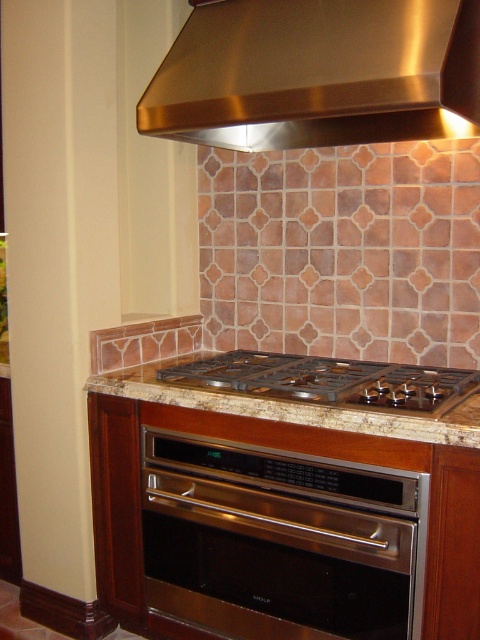
Question: In this image, where is stainless steel oven at center located relative to marble/granite countertop at center?

Choices:
 (A) left
 (B) right

Answer: (A)

Question: Which object is positioned closest to the marble/granite countertop at center?

Choices:
 (A) stainless steel oven at center
 (B) stainless steel exhaust hood at upper center

Answer: (A)

Question: Does stainless steel exhaust hood at upper center appear on the right side of marble/granite countertop at center?

Choices:
 (A) yes
 (B) no

Answer: (A)

Question: Considering the real-world distances, which object is farthest from the marble/granite countertop at center?

Choices:
 (A) stainless steel exhaust hood at upper center
 (B) stainless steel oven at center

Answer: (A)

Question: Which point is closer to the camera?

Choices:
 (A) stainless steel oven at center
 (B) stainless steel exhaust hood at upper center
 (C) marble/granite countertop at center

Answer: (B)

Question: Is stainless steel exhaust hood at upper center positioned behind marble/granite countertop at center?

Choices:
 (A) yes
 (B) no

Answer: (B)